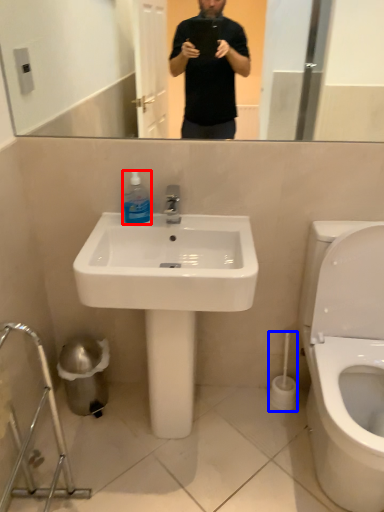
Question: Which object is further to the camera taking this photo, cleaning product (highlighted by a red box) or brush (highlighted by a blue box)?

Choices:
 (A) cleaning product
 (B) brush

Answer: (B)